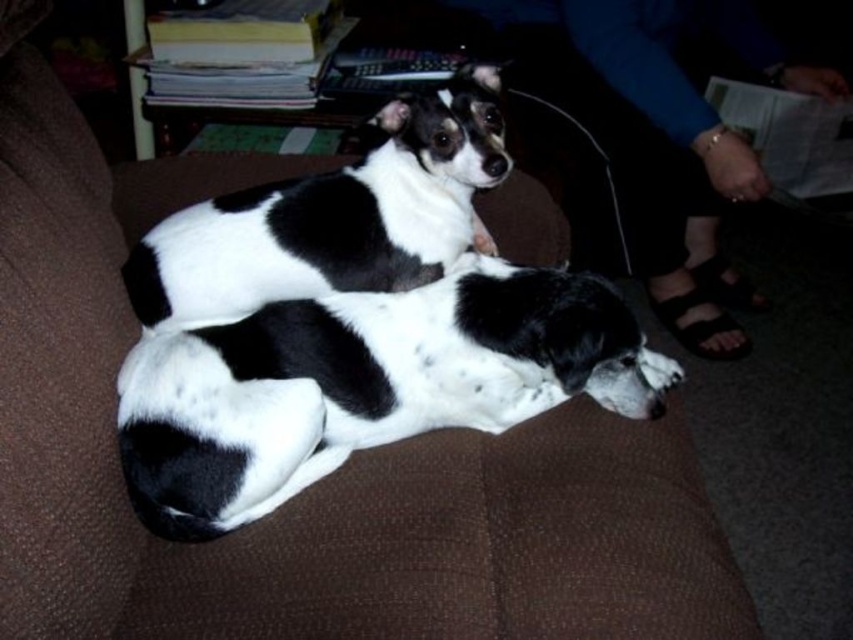
Is point (196, 384) in front of point (207, 282)?

Yes, it is.

Which is in front, point (424, 371) or point (329, 260)?

Point (329, 260)

Locate an element on the screen. black and white fur at center is located at coordinates (363, 385).